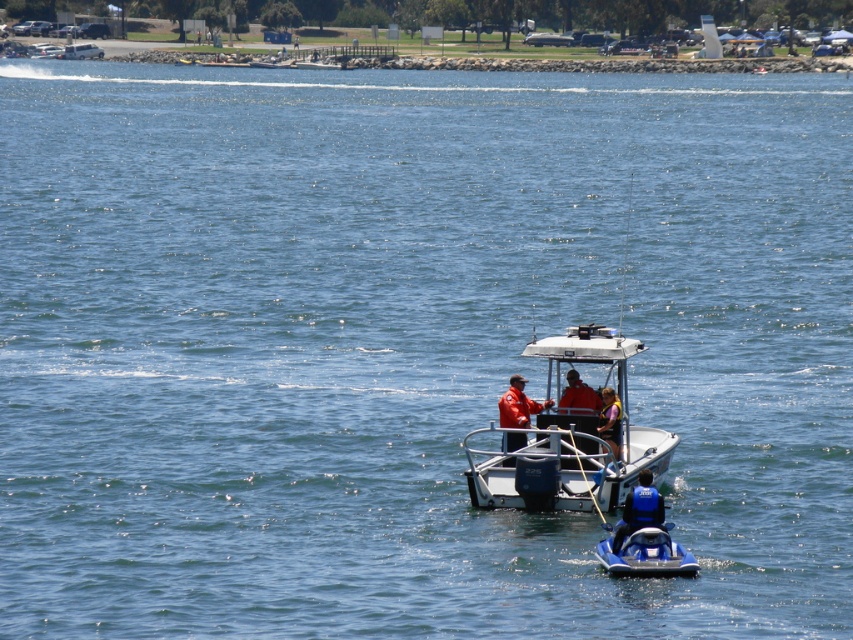
Question: Which point is farther to the camera?

Choices:
 (A) orange life vest at center
 (B) blue fabric life vest at lower center
 (C) white plastic boat at upper left
 (D) blue glossy jet ski at center

Answer: (C)

Question: Does silver metallic boat at center appear on the left side of orange fabric life vest at center?

Choices:
 (A) no
 (B) yes

Answer: (A)

Question: Is purple fabric life vest at center thinner than white plastic boat at upper left?

Choices:
 (A) yes
 (B) no

Answer: (A)

Question: Considering the relative positions of orange life vest at center and orange fabric life vest at center in the image provided, where is orange life vest at center located with respect to orange fabric life vest at center?

Choices:
 (A) right
 (B) left

Answer: (B)

Question: Considering the real-world distances, which object is closest to the orange life vest at center?

Choices:
 (A) blue glossy jet ski at center
 (B) silver metallic boat at center
 (C) orange fabric life vest at center

Answer: (C)

Question: Estimate the real-world distances between objects in this image. Which object is closer to the blue glossy jet ski at center?

Choices:
 (A) silver metallic boat at center
 (B) purple fabric life vest at center
 (C) orange life vest at center

Answer: (A)